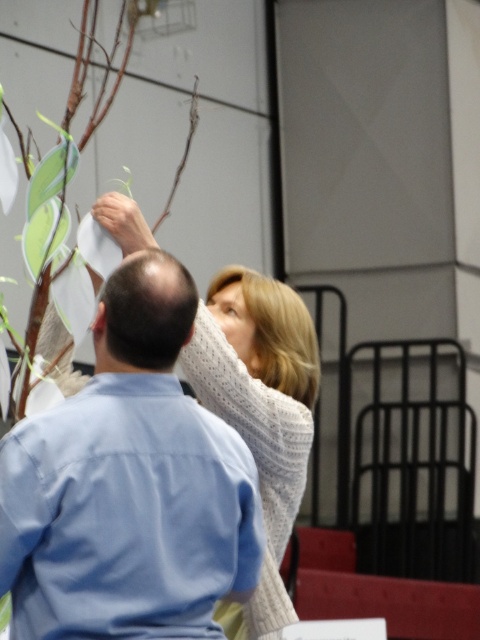
You are a photographer setting up a shoot in this indoor space. You need to position a tall light stand that is 2 meters high. The stand must be placed between the blue cotton shirt at upper left and the brown matte branch at upper center. Is there enough vertical space between them to accommodate the light stand without it touching either object?

The blue cotton shirt at upper left is much taller than the brown matte branch at upper center, so there is sufficient vertical space between them to place the 2 meter tall light stand without it touching either object.

From the picture: You are standing in the room and want to move from the point at coordinates point (179,452) to the point at coordinates point (190,124). Can you walk directly between them without any obstacles?

Point (179,452) is in front of point (190,124), so there might be an obstacle between them. You cannot walk directly between them without any obstacles.

You are a photographer positioned in front of the scene. You need to capture a photo where both the blue cotton shirt at upper left and the brown matte branch at upper center are clearly visible. However, your camera has a limited depth of field. Which object should you focus on to ensure both are in focus?

You should focus on the brown matte branch at upper center because it is farther from the viewer compared to the blue cotton shirt at upper left. By focusing on the farther object, the closer one will still be within the depth of field, ensuring both are in focus.